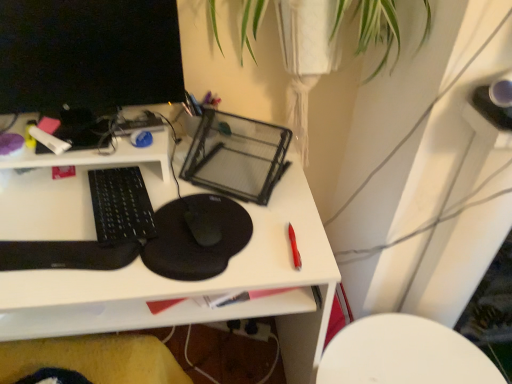
Locate an element on the screen. The image size is (512, 384). vacant area located to the right-hand side of black matte mouse at center is located at coordinates (264, 229).